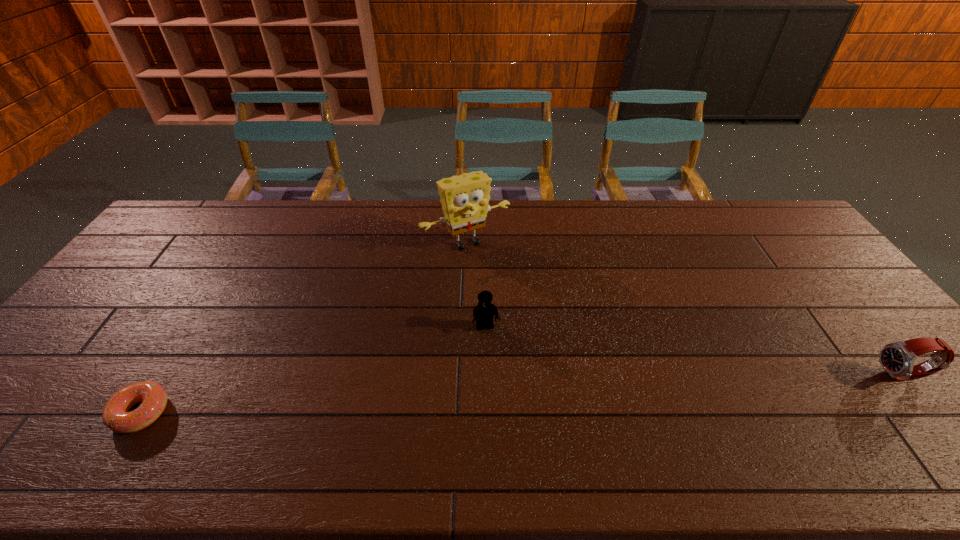
At what (x,y) coordinates should I click in order to perform the action: click on doughnut. Please return your answer as a coordinate pair (x, y). Looking at the image, I should click on (115, 416).

I want to click on the shortest object, so click(x=115, y=416).

What are the coordinates of `watch` in the screenshot? It's located at (898, 358).

Where is `the tallest object`? The image size is (960, 540). the tallest object is located at coordinates (464, 198).

You are a GUI agent. You are given a task and a screenshot of the screen. Output one action in this format:
    pyautogui.click(x=<x>, y=<y>)
    Task: Click on the farthest object
    This screenshot has width=960, height=540.
    Given the screenshot: What is the action you would take?
    pyautogui.click(x=464, y=198)

Identify the location of the third nearest object. The width and height of the screenshot is (960, 540). (483, 313).

Where is `blank space located 0.360m on the back of the doughnut`? blank space located 0.360m on the back of the doughnut is located at coordinates (219, 286).

Find the location of a particular element. Image resolution: width=960 pixels, height=540 pixels. vacant space located 0.110m on the face of the rightmost object is located at coordinates (833, 376).

Find the location of `vacant space situated on the face of the rightmost object`. vacant space situated on the face of the rightmost object is located at coordinates (817, 376).

Locate an element on the screen. Image resolution: width=960 pixels, height=540 pixels. free space located 0.270m on the face of the rightmost object is located at coordinates (769, 376).